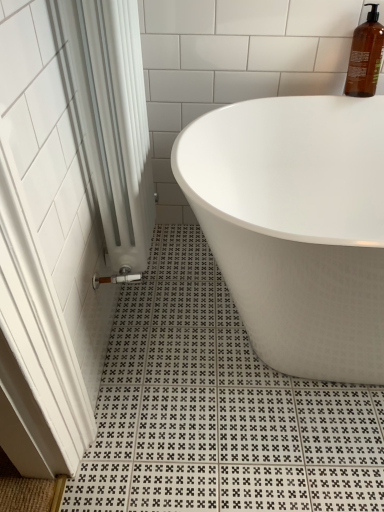
You are a GUI agent. You are given a task and a screenshot of the screen. Output one action in this format:
    pyautogui.click(x=<x>, y=<y>)
    Task: Click on the white glossy bathtub at center
    The image size is (384, 512).
    Given the screenshot: What is the action you would take?
    pyautogui.click(x=296, y=226)

The width and height of the screenshot is (384, 512). Describe the element at coordinates (296, 226) in the screenshot. I see `white glossy bathtub at center` at that location.

The width and height of the screenshot is (384, 512). Describe the element at coordinates (365, 56) in the screenshot. I see `translucent amber bottle at upper right` at that location.

You are a GUI agent. You are given a task and a screenshot of the screen. Output one action in this format:
    pyautogui.click(x=<x>, y=<y>)
    Task: Click on the white fabric shower curtain at left
    The image size is (384, 512).
    Given the screenshot: What is the action you would take?
    pyautogui.click(x=110, y=117)

Who is bigger, white glossy bathtub at center or white fabric shower curtain at left?

white glossy bathtub at center.

The image size is (384, 512). There is a white glossy bathtub at center. Identify the location of shower curtain above it (from a real-world perspective). (110, 117).

From the image's perspective, which one is positioned higher, white glossy bathtub at center or white fabric shower curtain at left?

white fabric shower curtain at left appears higher in the image.

From their relative heights in the image, would you say white glossy bathtub at center is taller or shorter than white fabric shower curtain at left?

white glossy bathtub at center is shorter than white fabric shower curtain at left.

Could you tell me if translucent amber bottle at upper right is turned towards white fabric shower curtain at left?

No, translucent amber bottle at upper right is not turned towards white fabric shower curtain at left.

Consider the image. Does translucent amber bottle at upper right come in front of white fabric shower curtain at left?

No, translucent amber bottle at upper right is further to the viewer.

Can you confirm if translucent amber bottle at upper right is wider than white fabric shower curtain at left?

In fact, translucent amber bottle at upper right might be narrower than white fabric shower curtain at left.

Is point (72, 27) behind point (366, 94)?

No.

Which is correct: white fabric shower curtain at left is inside translucent amber bottle at upper right, or outside of it?

white fabric shower curtain at left is not enclosed by translucent amber bottle at upper right.

At what (x,y) coordinates should I click in order to perform the action: click on shower curtain directly beneath the translucent amber bottle at upper right (from a real-world perspective). Please return your answer as a coordinate pair (x, y). Looking at the image, I should click on (110, 117).

Which is behind, white fabric shower curtain at left or translucent amber bottle at upper right?

translucent amber bottle at upper right is behind.

Are white fabric shower curtain at left and white glossy bathtub at center beside each other?

white fabric shower curtain at left and white glossy bathtub at center are not in contact.

How many degrees apart are the facing directions of white fabric shower curtain at left and white glossy bathtub at center?

There is a 90-degree angle between the facing directions of white fabric shower curtain at left and white glossy bathtub at center.

Is white fabric shower curtain at left behind white glossy bathtub at center?

No, white fabric shower curtain at left is closer to the viewer.

From the image's perspective, is white fabric shower curtain at left positioned above or below white glossy bathtub at center?

Clearly, from the image's perspective, white fabric shower curtain at left is above white glossy bathtub at center.

Which is in front, point (374, 11) or point (382, 132)?

The point (374, 11) is closer.

How far apart are translucent amber bottle at upper right and white glossy bathtub at center?

A distance of 17.49 inches exists between translucent amber bottle at upper right and white glossy bathtub at center.

Is translucent amber bottle at upper right inside the boundaries of white glossy bathtub at center, or outside?

translucent amber bottle at upper right is located beyond the bounds of white glossy bathtub at center.

From a real-world perspective, is white glossy bathtub at center physically below translucent amber bottle at upper right?

Yes, from a real-world perspective, white glossy bathtub at center is below translucent amber bottle at upper right.

Which point is more distant from viewer, (x=292, y=172) or (x=365, y=6)?

The point (x=292, y=172) is more distant.

Which is behind, white glossy bathtub at center or translucent amber bottle at upper right?

translucent amber bottle at upper right is behind.

Which of these two, white glossy bathtub at center or translucent amber bottle at upper right, is thinner?

With smaller width is translucent amber bottle at upper right.

Find the location of a particular element. The width and height of the screenshot is (384, 512). bathtub that is below the white fabric shower curtain at left (from the image's perspective) is located at coordinates (296, 226).

Identify the location of shower curtain beneath the translucent amber bottle at upper right (from a real-world perspective). click(x=110, y=117).

Estimate the real-world distances between objects in this image. Which object is closer to white glossy bathtub at center, white fabric shower curtain at left or translucent amber bottle at upper right?

white fabric shower curtain at left.

From the image, which object appears to be nearer to white glossy bathtub at center, translucent amber bottle at upper right or white fabric shower curtain at left?

Based on the image, white fabric shower curtain at left appears to be nearer to white glossy bathtub at center.

When comparing their distances from white fabric shower curtain at left, does translucent amber bottle at upper right or white glossy bathtub at center seem further?

Based on the image, translucent amber bottle at upper right appears to be further to white fabric shower curtain at left.

From the image, which object appears to be nearer to white fabric shower curtain at left, white glossy bathtub at center or translucent amber bottle at upper right?

Based on the image, white glossy bathtub at center appears to be nearer to white fabric shower curtain at left.

Based on the photo, which object lies nearer to the anchor point translucent amber bottle at upper right, white glossy bathtub at center or white fabric shower curtain at left?

white glossy bathtub at center is positioned closer to the anchor translucent amber bottle at upper right.

Based on their spatial positions, is white fabric shower curtain at left or white glossy bathtub at center closer to translucent amber bottle at upper right?

white glossy bathtub at center lies closer to translucent amber bottle at upper right than the other object.

The width and height of the screenshot is (384, 512). Find the location of `bathtub located between white fabric shower curtain at left and translucent amber bottle at upper right in the left-right direction`. bathtub located between white fabric shower curtain at left and translucent amber bottle at upper right in the left-right direction is located at coordinates (296, 226).